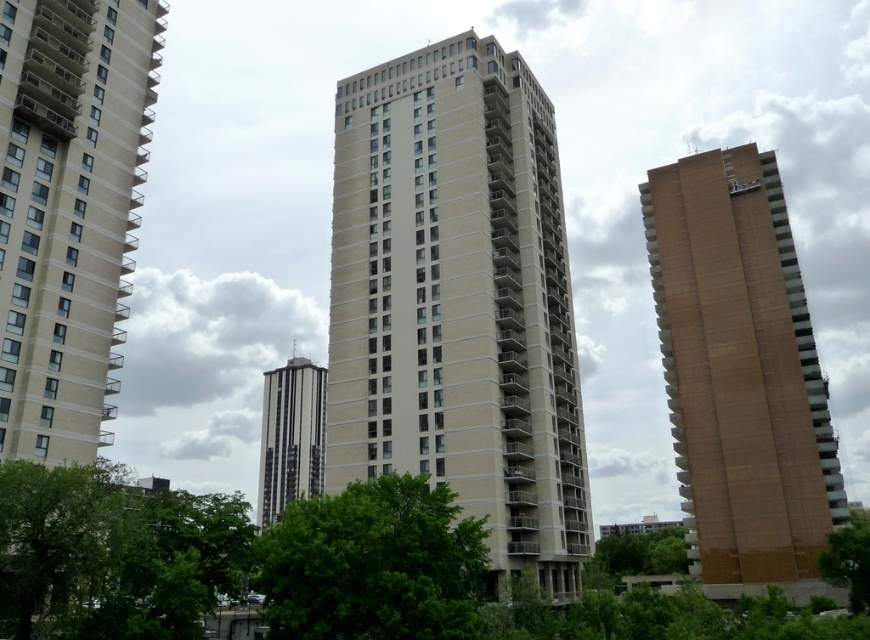
Question: Is brown concrete building at right wider than green leafy tree at lower left?

Choices:
 (A) no
 (B) yes

Answer: (A)

Question: Based on their relative distances, which object is farther from the green leafy tree at center?

Choices:
 (A) brown concrete building at right
 (B) green leafy tree at lower left
 (C) beige concrete building at center

Answer: (A)

Question: Does beige concrete building at left appear under green leafy tree at lower left?

Choices:
 (A) yes
 (B) no

Answer: (B)

Question: Which object is the farthest from the green leafy tree at lower right?

Choices:
 (A) metallic silver tower at center
 (B) brown concrete building at right

Answer: (A)

Question: Which object is positioned closest to the metallic silver tower at center?

Choices:
 (A) green leafy tree at center
 (B) beige concrete building at center

Answer: (B)

Question: Can you confirm if beige concrete building at center is positioned to the left of metallic silver tower at center?

Choices:
 (A) no
 (B) yes

Answer: (A)